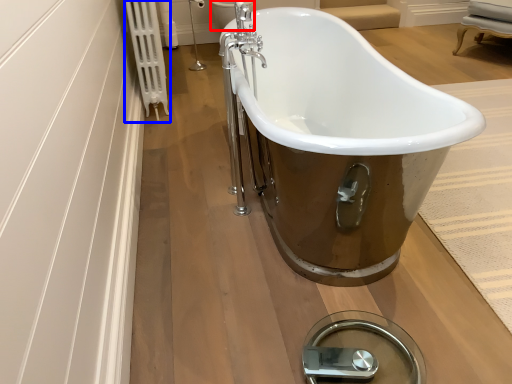
Question: Which of the following is the farthest to the observer, toilet bowl (highlighted by a red box) or radiator (highlighted by a blue box)?

Choices:
 (A) toilet bowl
 (B) radiator

Answer: (A)